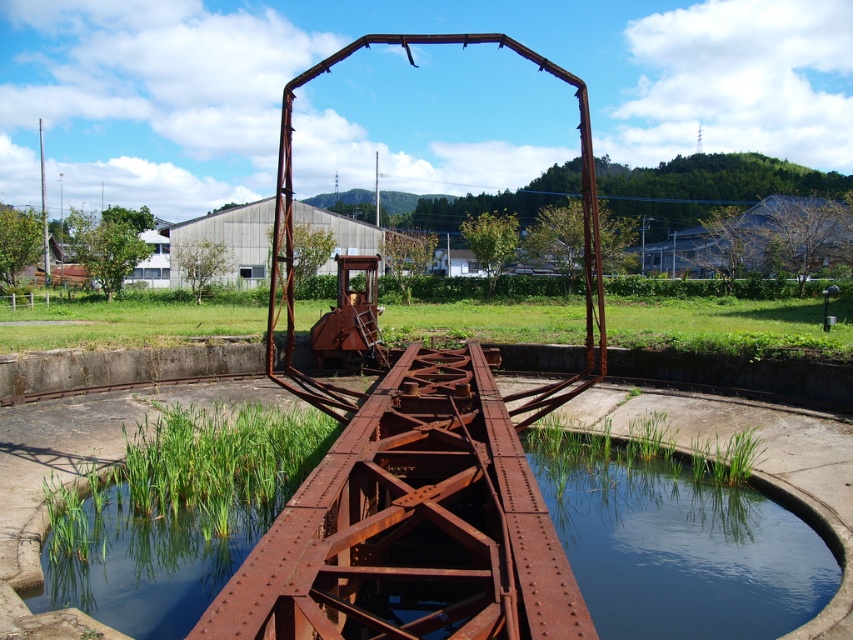
This screenshot has width=853, height=640. In order to click on rusty metal pond at center in this screenshot , I will do point(677,547).

Does rusty metal rail at center have a greater height compared to clear water at bottom center?

Yes, rusty metal rail at center is taller than clear water at bottom center.

Which is in front, point (492, 573) or point (686, 600)?

Point (492, 573)

I want to click on rusty metal rail at center, so click(x=410, y=525).

Who is positioned more to the right, rusty metal rail at center or rusty metal pond at center?

rusty metal pond at center is more to the right.

Image resolution: width=853 pixels, height=640 pixels. What do you see at coordinates (410, 525) in the screenshot?
I see `rusty metal rail at center` at bounding box center [410, 525].

The height and width of the screenshot is (640, 853). Identify the location of rusty metal rail at center. (410, 525).